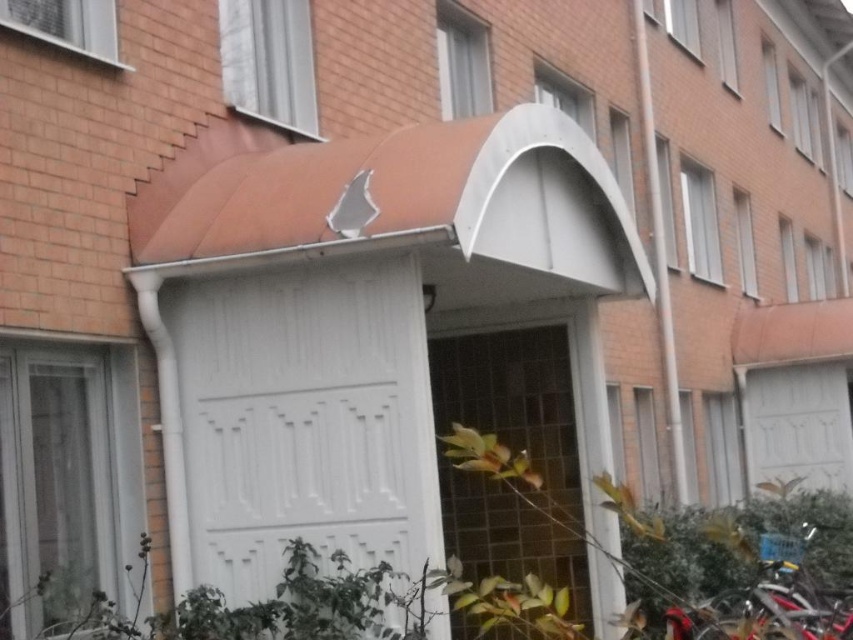
Question: Is white matte awning at center above white painted wood garage door at center?

Choices:
 (A) no
 (B) yes

Answer: (B)

Question: Which object is the farthest from the shiny red bicycle at lower right?

Choices:
 (A) white matte awning at center
 (B) white painted wood garage door at center

Answer: (B)

Question: Is white painted wood garage door at center further to the viewer compared to shiny red bicycle at lower right?

Choices:
 (A) yes
 (B) no

Answer: (B)

Question: Which point is closer to the camera taking this photo?

Choices:
 (A) (775, 612)
 (B) (421, 500)
 (C) (399, 509)

Answer: (B)

Question: Does white matte awning at center lie in front of shiny red bicycle at lower right?

Choices:
 (A) no
 (B) yes

Answer: (B)

Question: Among these objects, which one is farthest from the camera?

Choices:
 (A) white matte awning at center
 (B) shiny red bicycle at lower right

Answer: (B)